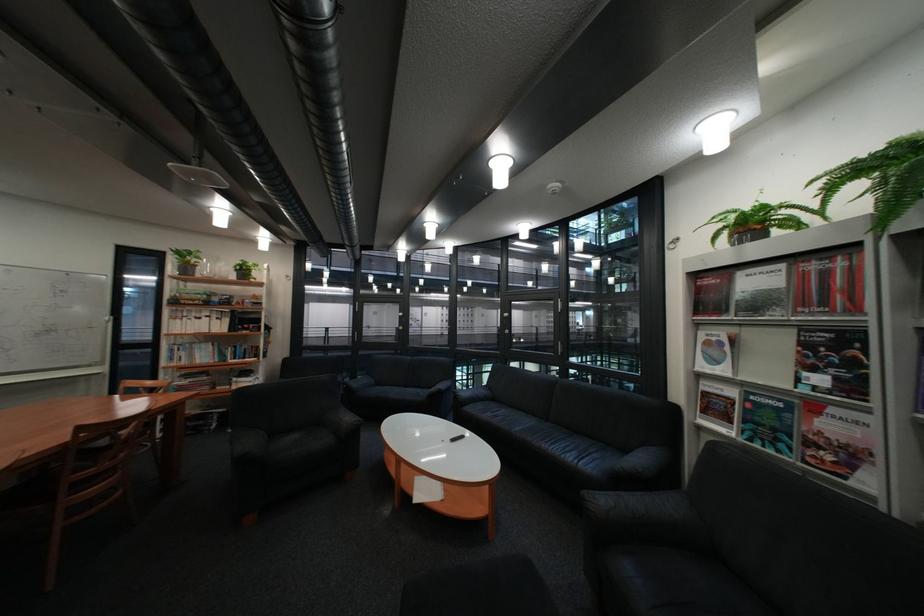
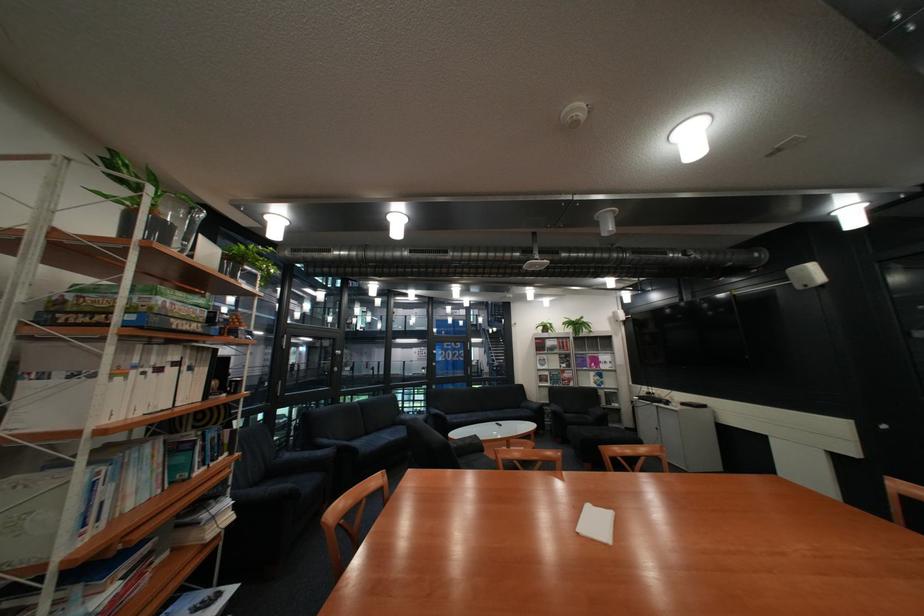
The point at (x=420, y=387) is marked in the first image. Where is the corresponding point in the second image?

(383, 434)